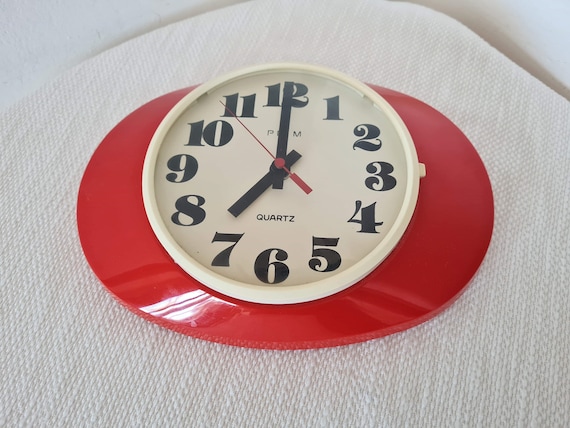
The image size is (570, 428). I want to click on "6" on clock face, so click(260, 262).